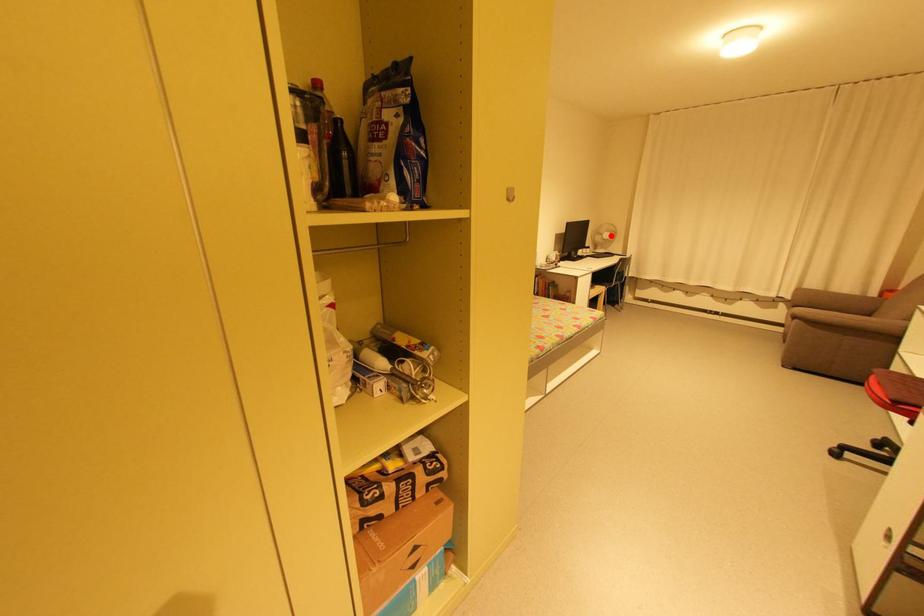
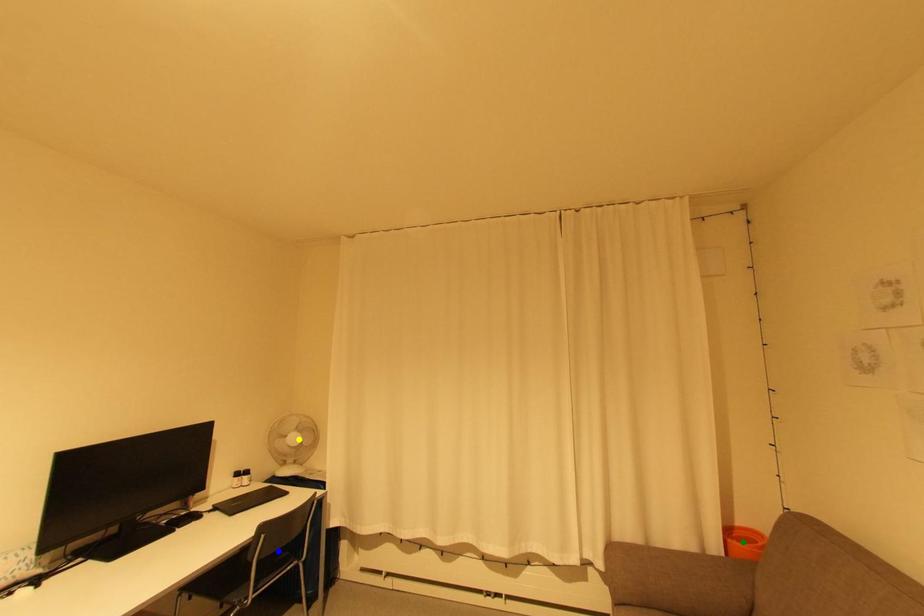
Question: I am providing you with two images of the same scene from different viewpoints. A red point is marked on the first image. You are given multiple points on the second image. Which point in image 2 represents the same 3d spot as the red point in image 1?

Choices:
 (A) yellow point
 (B) blue point
 (C) green point

Answer: (A)